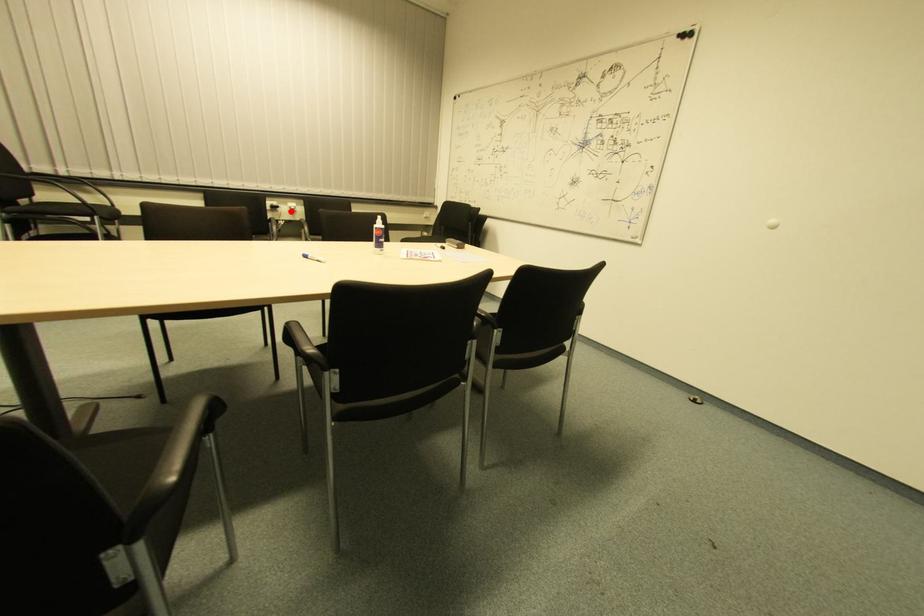
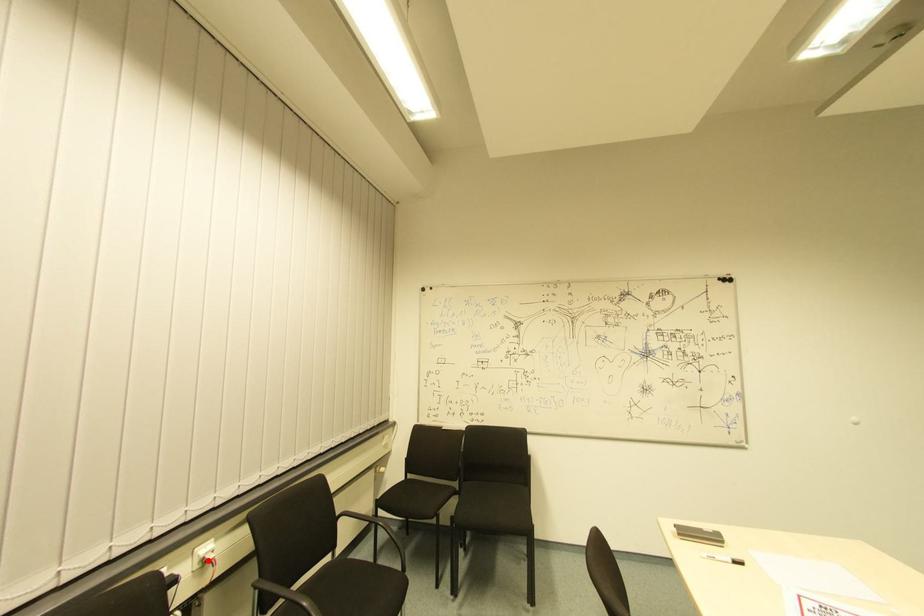
I am providing you with two images of the same scene from different viewpoints. A red point is marked on the first image and another point is marked on the second image. Are the points marked in image1 and image2 representing the same 3D position?

Yes